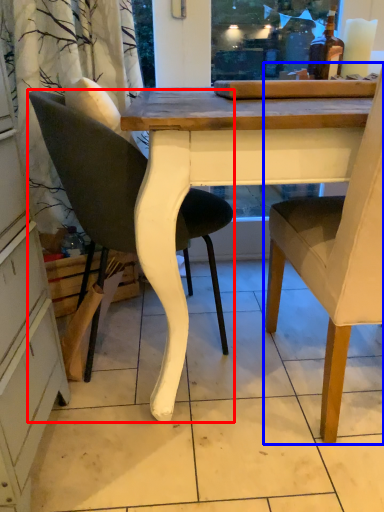
Question: Which object is closer to the camera taking this photo, chair (highlighted by a red box) or chair (highlighted by a blue box)?

Choices:
 (A) chair
 (B) chair

Answer: (B)